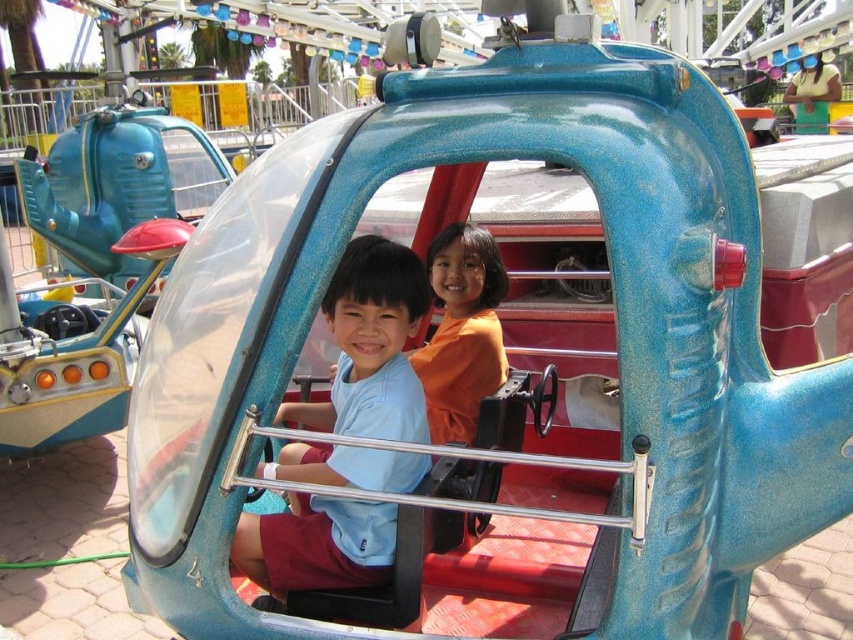
How distant is matte blue shirt at center from orange matte shirt at center?

They are 32.73 inches apart.

Does matte blue shirt at center appear on the left side of orange matte shirt at center?

Indeed, matte blue shirt at center is positioned on the left side of orange matte shirt at center.

Measure the distance between point (381, 321) and camera.

Point (381, 321) and camera are 2.34 meters apart.

At what (x,y) coordinates should I click in order to perform the action: click on matte blue shirt at center. Please return your answer as a coordinate pair (x, y). This screenshot has width=853, height=640. Looking at the image, I should click on (370, 346).